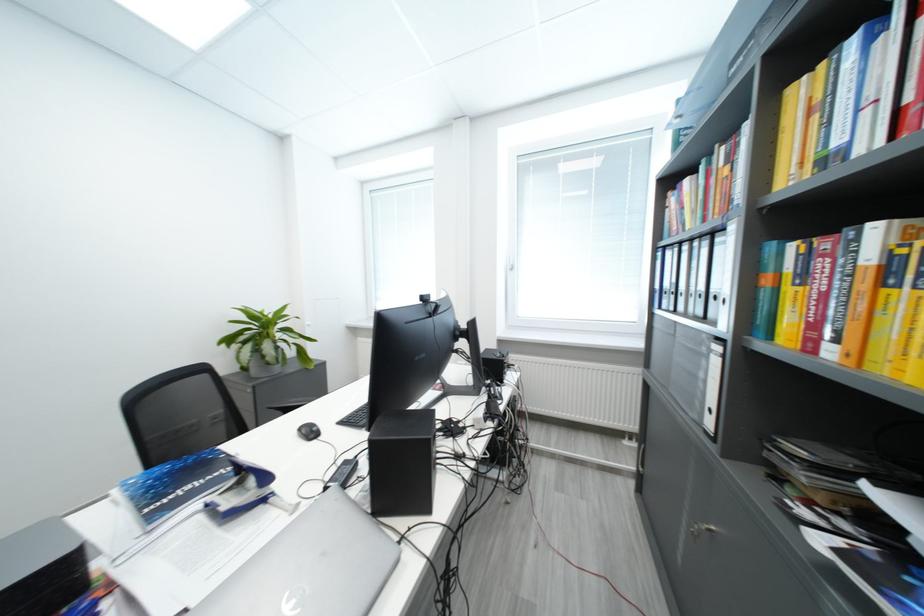
Where is `white window handle`? white window handle is located at coordinates (507, 259).